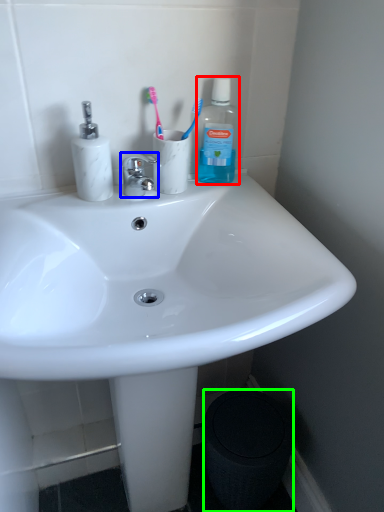
Question: Which object is the farthest from bottle (highlighted by a red box)? Choose among these: faucet (highlighted by a blue box) or trash bin/can (highlighted by a green box).

Choices:
 (A) faucet
 (B) trash bin/can

Answer: (B)